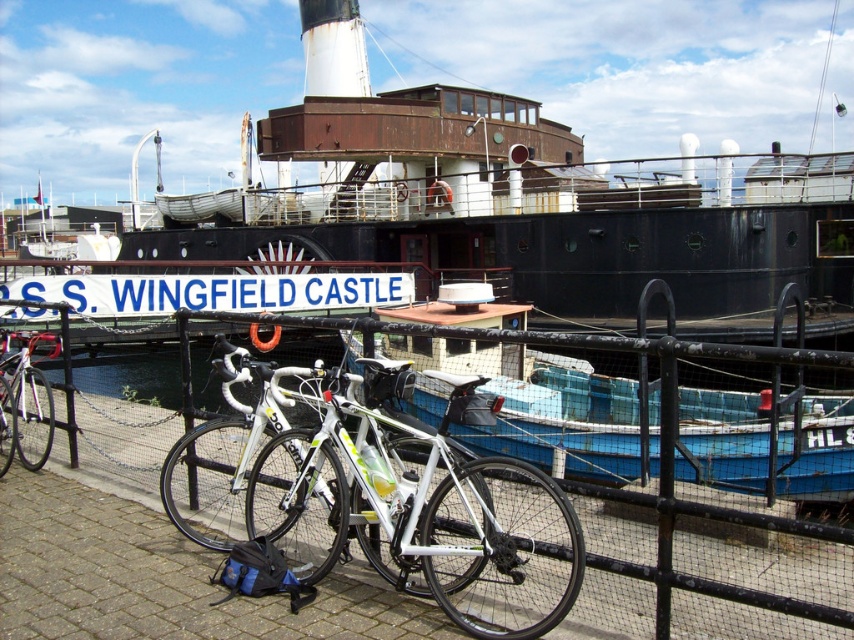
Does blue plastic boat at center appear over shiny silver bicycle at left?

Incorrect, blue plastic boat at center is not positioned above shiny silver bicycle at left.

Who is more distant from viewer, (610,458) or (16,396)?

Point (610,458)

Measure the distance between blue plastic boat at center and camera.

A distance of 28.67 feet exists between blue plastic boat at center and camera.

Locate an element on the screen. blue plastic boat at center is located at coordinates (565, 419).

Which of these two, white glossy bicycle at center or blue plastic boat at center, stands taller?

white glossy bicycle at center is taller.

From the picture: Can you confirm if white glossy bicycle at center is bigger than blue plastic boat at center?

Yes, white glossy bicycle at center is bigger than blue plastic boat at center.

Which is in front, point (466, 388) or point (736, 417)?

Point (466, 388)

You are a GUI agent. You are given a task and a screenshot of the screen. Output one action in this format:
    pyautogui.click(x=<x>, y=<y>)
    Task: Click on the white glossy bicycle at center
    
    Given the screenshot: What is the action you would take?
    pyautogui.click(x=383, y=497)

Does rusty metal ship at center have a smaller size compared to blue plastic boat at center?

Incorrect, rusty metal ship at center is not smaller in size than blue plastic boat at center.

Describe the element at coordinates (619, 65) in the screenshot. Image resolution: width=854 pixels, height=640 pixels. I see `rusty metal ship at center` at that location.

Locate an element on the screen. rusty metal ship at center is located at coordinates (619, 65).